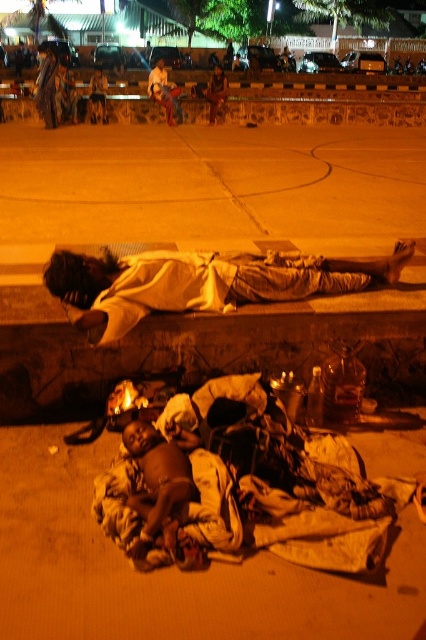
Is brown fabric blanket at lower center shorter than dark skin baby at lower center?

No, brown fabric blanket at lower center is not shorter than dark skin baby at lower center.

What are the coordinates of `brown fabric blanket at lower center` in the screenshot? It's located at (169, 568).

Based on the photo, which of these two, white clothed person at center or dark skin baby at lower center, stands taller?

With more height is white clothed person at center.

Can you confirm if white clothed person at center is thinner than dark skin baby at lower center?

Incorrect, white clothed person at center's width is not less than dark skin baby at lower center's.

Where is `white clothed person at center`? Image resolution: width=426 pixels, height=640 pixels. white clothed person at center is located at coordinates (201, 282).

This screenshot has width=426, height=640. Identify the location of white clothed person at center. coord(201,282).

Between brown fabric blanket at lower center and white clothed person at center, which one is positioned lower?

brown fabric blanket at lower center is lower down.

Does point (290, 589) come closer to viewer compared to point (233, 269)?

Yes, it is in front of point (233, 269).

Locate an element on the screen. Image resolution: width=426 pixels, height=640 pixels. brown fabric blanket at lower center is located at coordinates (169, 568).